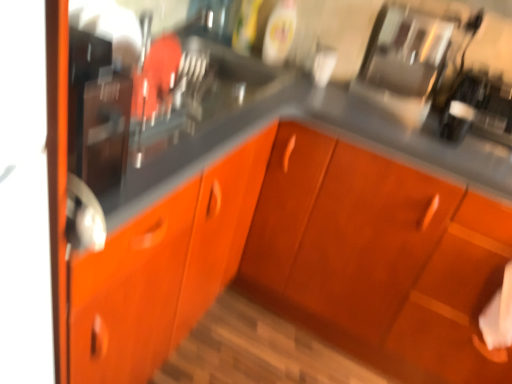
Question: Considering the relative sizes of glossy stainless steel coffee maker at upper right and matte black sink at left in the image provided, is glossy stainless steel coffee maker at upper right shorter than matte black sink at left?

Choices:
 (A) yes
 (B) no

Answer: (A)

Question: Is the depth of glossy stainless steel coffee maker at upper right greater than that of matte black sink at left?

Choices:
 (A) yes
 (B) no

Answer: (A)

Question: Does glossy stainless steel coffee maker at upper right contain matte black sink at left?

Choices:
 (A) yes
 (B) no

Answer: (B)

Question: Is the position of glossy stainless steel coffee maker at upper right less distant than that of matte black sink at left?

Choices:
 (A) yes
 (B) no

Answer: (B)

Question: Is glossy stainless steel coffee maker at upper right at the right side of matte black sink at left?

Choices:
 (A) yes
 (B) no

Answer: (A)

Question: Is glossy stainless steel coffee maker at upper right with matte black sink at left?

Choices:
 (A) yes
 (B) no

Answer: (B)

Question: Is matte black sink at left aimed at glossy stainless steel coffee maker at upper right?

Choices:
 (A) yes
 (B) no

Answer: (B)

Question: Can glossy stainless steel coffee maker at upper right be found inside matte black sink at left?

Choices:
 (A) yes
 (B) no

Answer: (B)

Question: Is matte black sink at left positioned beyond the bounds of glossy stainless steel coffee maker at upper right?

Choices:
 (A) no
 (B) yes

Answer: (B)

Question: Considering the relative positions of matte black sink at left and glossy stainless steel coffee maker at upper right in the image provided, is matte black sink at left to the left of glossy stainless steel coffee maker at upper right from the viewer's perspective?

Choices:
 (A) yes
 (B) no

Answer: (A)

Question: Does matte black sink at left have a lesser width compared to glossy stainless steel coffee maker at upper right?

Choices:
 (A) no
 (B) yes

Answer: (B)

Question: From a real-world perspective, is matte black sink at left on glossy stainless steel coffee maker at upper right?

Choices:
 (A) no
 (B) yes

Answer: (B)

Question: Is matte black sink at left completely or partially outside of orange matte cabinet at center?

Choices:
 (A) no
 (B) yes

Answer: (B)